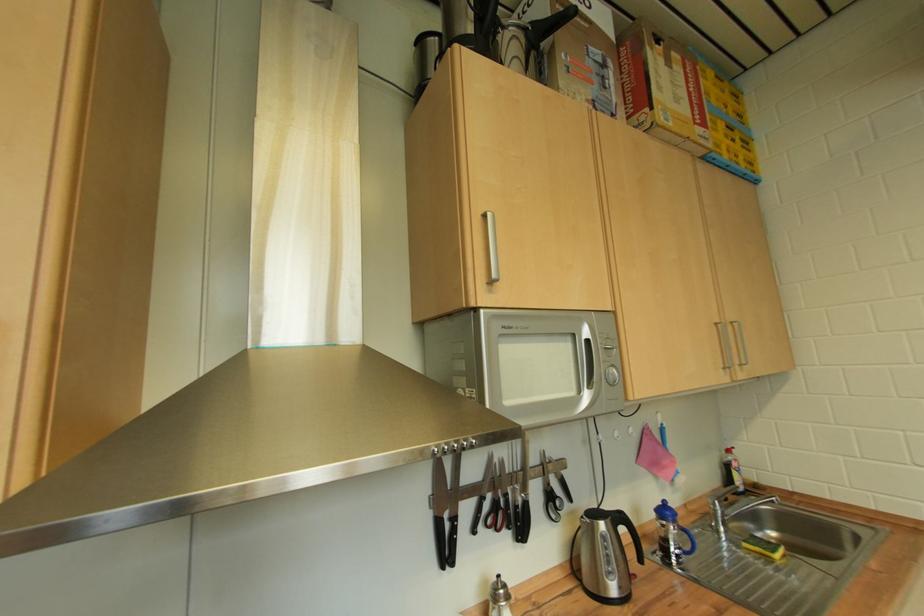
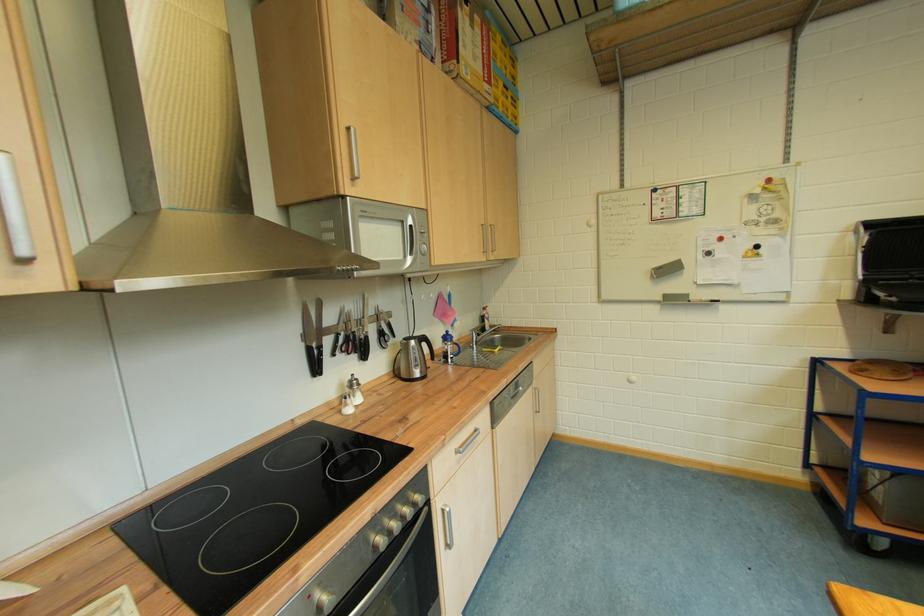
The point at (436, 500) is marked in the first image. Where is the corresponding point in the second image?

(310, 337)